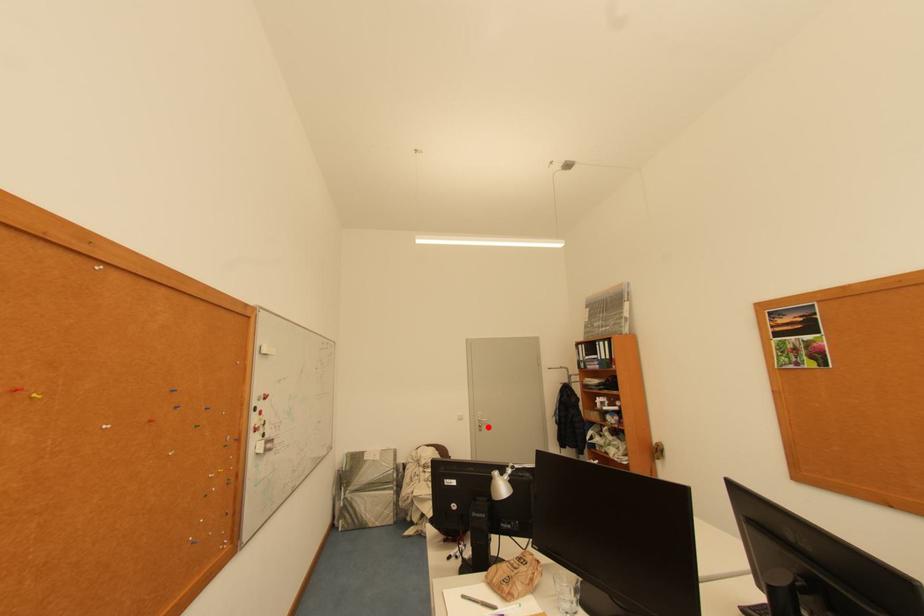
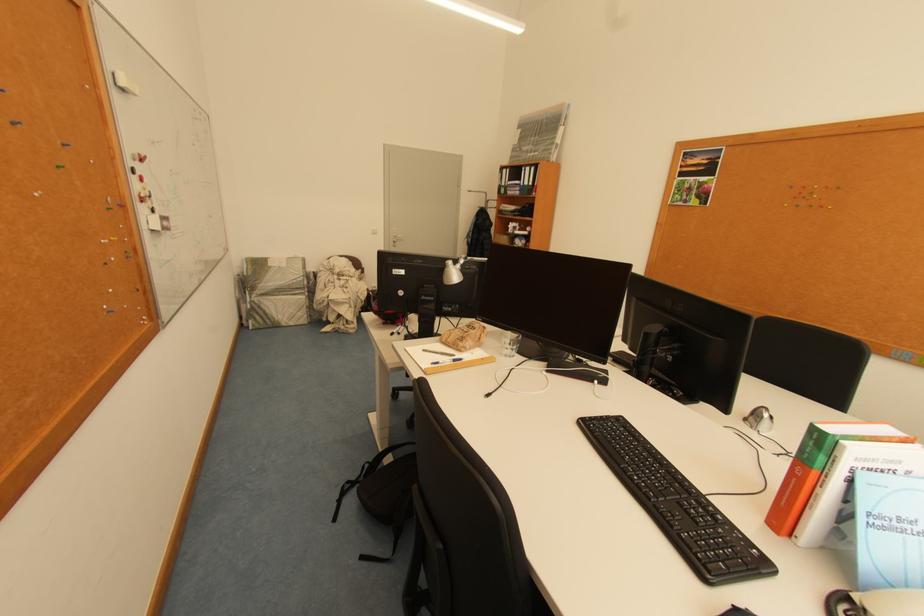
Locate, in the second image, the point that corresponds to the highlighted location in the first image.

(402, 243)